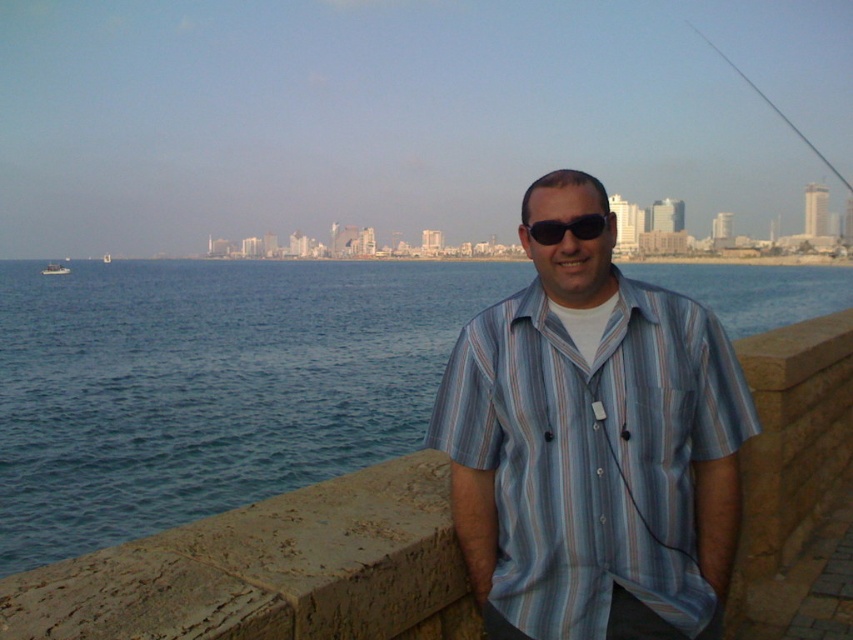
You are a drone operator who needs to deliver a package from the man standing by the waterfront to the point at coordinates point (280,310). Given that your drone can carry a maximum weight of 5 pounds and has a maximum flight range of 400 feet, will the drone be able to complete the delivery without needing to recharge?

The distance between the man standing by the waterfront and the point at coordinates point (280,310) is 361.27 feet. Since the drone has a maximum flight range of 400 feet, it can complete the delivery without needing to recharge as long as the package weighs 5 pounds or less.

You are a fashion designer analyzing the image. You need to determine the position of the blue striped shirt at center relative to the city skyline in the distance. Is the shirt positioned closer to the foreground or the background of the image?

The blue striped shirt at center is located at point (592, 444), which places it in the foreground since it is closer to the viewer compared to the city skyline in the background.